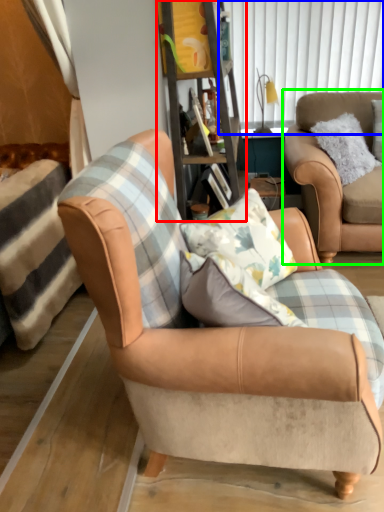
Question: Based on their relative distances, which object is nearer to bookshelf (highlighted by a red box)? Choose from window screen (highlighted by a blue box) and chair (highlighted by a green box).

Choices:
 (A) window screen
 (B) chair

Answer: (B)